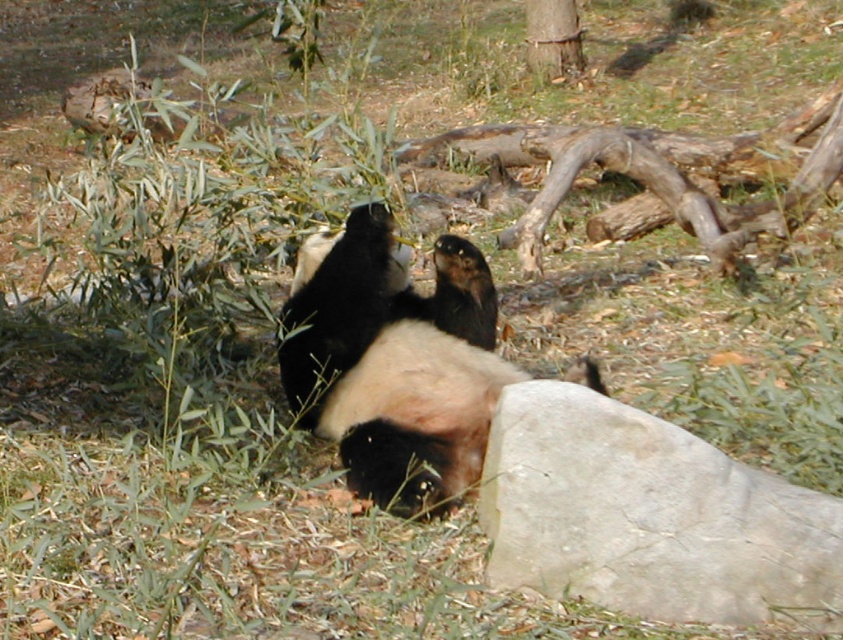
You are standing in front of the panda enclosure and want to take a photo of the black fur panda at center. If your camera has a minimum focusing distance of 3 meters, will you be able to take a clear photo without moving closer?

The black fur panda at center and viewer are 2.57 meters apart. Since the minimum focusing distance is 3 meters, you need to move back to at least 3 meters away to take a clear photo.

You are a zookeeper who needs to feed the black fur panda at center. You have a bamboo stalk that is 20 inches long. Can you safely hand the bamboo stalk to the panda without it reaching over the gray rough rock at lower right?

The gray rough rock at lower right is 20.82 inches from the black fur panda at center. Since the bamboo stalk is only 20 inches long, the panda would need to stretch beyond the bamboo stalk to reach the rock. Therefore, it is safe to hand the bamboo stalk to the black fur panda at center without it needing to reach over the gray rough rock at lower right.